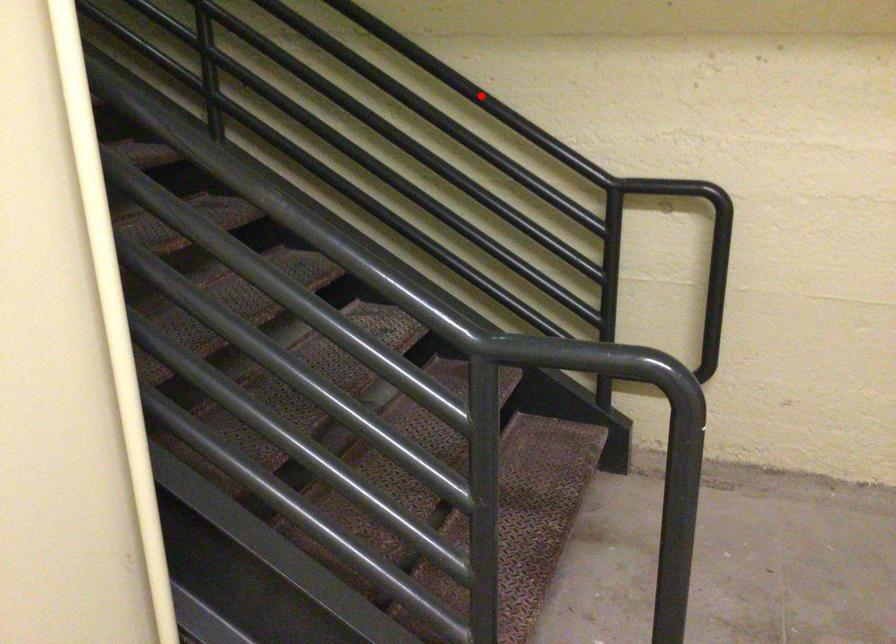
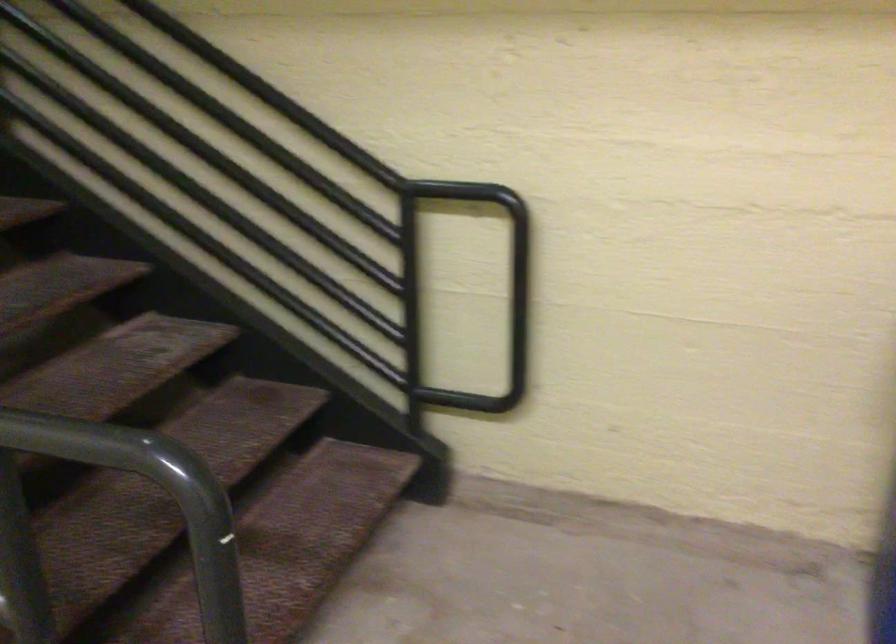
The point at the highlighted location is marked in the first image. Where is the corresponding point in the second image?

(265, 91)